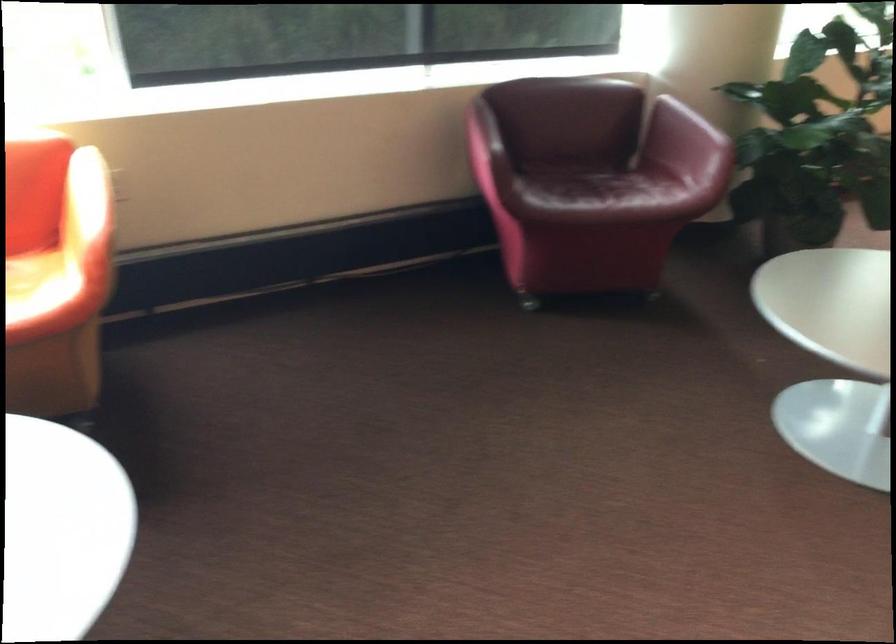
This screenshot has height=644, width=896. What do you see at coordinates (483, 140) in the screenshot? I see `the red chair armrest` at bounding box center [483, 140].